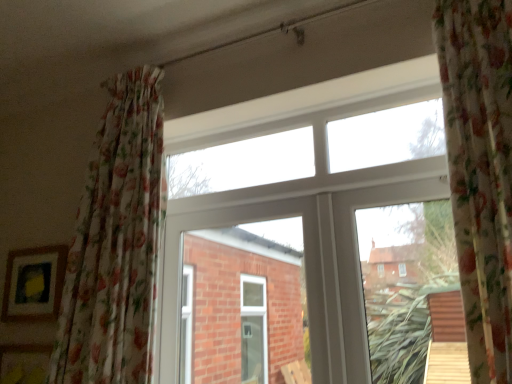
Question: From a real-world perspective, is matte wooden picture frame at lower left positioned above or below white plastic window at center?

Choices:
 (A) below
 (B) above

Answer: (A)

Question: From the image's perspective, is matte wooden picture frame at lower left positioned above or below white plastic window at center?

Choices:
 (A) below
 (B) above

Answer: (A)

Question: Which object is the farthest from the matte wooden picture frame at lower left?

Choices:
 (A) white plastic window at center
 (B) floral fabric curtain at left

Answer: (A)

Question: Which is farther from the matte wooden picture frame at lower left?

Choices:
 (A) floral fabric curtain at left
 (B) white plastic window at center

Answer: (B)